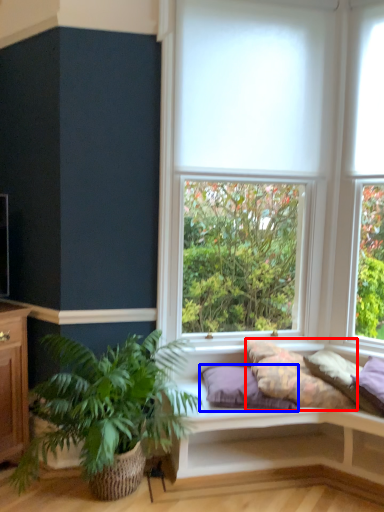
Question: Which object is closer to the camera taking this photo, pillow (highlighted by a red box) or pillow (highlighted by a blue box)?

Choices:
 (A) pillow
 (B) pillow

Answer: (A)